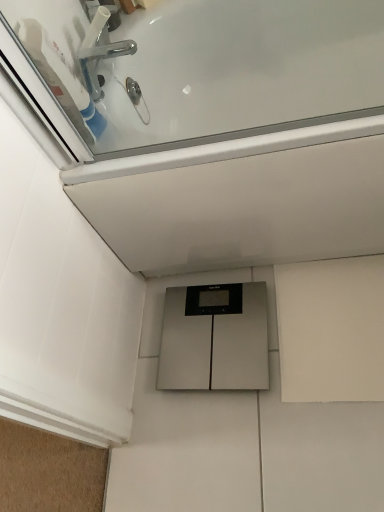
Describe the element at coordinates (215, 338) in the screenshot. The image size is (384, 512). I see `silver metallic scale at center` at that location.

What are the coordinates of `chrome metallic faucet at upper left` in the screenshot? It's located at (x=99, y=47).

From a real-world perspective, is chrome metallic faucet at upper left physically below silver metallic scale at center?

No, from a real-world perspective, chrome metallic faucet at upper left is not beneath silver metallic scale at center.

Between chrome metallic faucet at upper left and silver metallic scale at center, which one has smaller size?

chrome metallic faucet at upper left is smaller.

Which object is more forward, chrome metallic faucet at upper left or silver metallic scale at center?

Positioned in front is chrome metallic faucet at upper left.

Is white glossy bathtub at upper center situated inside silver metallic scale at center or outside?

white glossy bathtub at upper center cannot be found inside silver metallic scale at center.

Which is in front, white glossy bathtub at upper center or silver metallic scale at center?

white glossy bathtub at upper center is more forward.

Can you see white glossy bathtub at upper center touching silver metallic scale at center?

No, white glossy bathtub at upper center is not with silver metallic scale at center.

From the image's perspective, relative to white glossy bathtub at upper center, is silver metallic scale at center above or below?

silver metallic scale at center is situated lower than white glossy bathtub at upper center in the image.

Is white glossy bathtub at upper center surrounded by silver metallic scale at center?

No, white glossy bathtub at upper center is not a part of silver metallic scale at center.

Considering the relative positions of silver metallic scale at center and white glossy bathtub at upper center in the image provided, is silver metallic scale at center to the right of white glossy bathtub at upper center from the viewer's perspective?

Incorrect, silver metallic scale at center is not on the right side of white glossy bathtub at upper center.

This screenshot has height=512, width=384. I want to click on bath that appears in front of the silver metallic scale at center, so click(239, 70).

Can you tell me how much chrome metallic faucet at upper left and white glossy bathtub at upper center differ in facing direction?

88.4 degrees separate the facing orientations of chrome metallic faucet at upper left and white glossy bathtub at upper center.

You are a GUI agent. You are given a task and a screenshot of the screen. Output one action in this format:
    pyautogui.click(x=<x>, y=<y>)
    Task: Click on the tap on the left of white glossy bathtub at upper center
    Image resolution: width=384 pixels, height=512 pixels.
    Given the screenshot: What is the action you would take?
    pyautogui.click(x=99, y=47)

Based on the photo, is chrome metallic faucet at upper left oriented away from white glossy bathtub at upper center?

chrome metallic faucet at upper left is not turned away from white glossy bathtub at upper center.

Is silver metallic scale at center in front of or behind chrome metallic faucet at upper left in the image?

In the image, silver metallic scale at center appears behind chrome metallic faucet at upper left.

Looking at their sizes, would you say silver metallic scale at center is wider or thinner than chrome metallic faucet at upper left?

silver metallic scale at center is wider than chrome metallic faucet at upper left.

Which of these two, silver metallic scale at center or chrome metallic faucet at upper left, is smaller?

With smaller size is chrome metallic faucet at upper left.

From the image's perspective, relative to chrome metallic faucet at upper left, is silver metallic scale at center above or below?

From the image's perspective, silver metallic scale at center appears below chrome metallic faucet at upper left.

From the image's perspective, between white glossy bathtub at upper center and chrome metallic faucet at upper left, which one is located above?

chrome metallic faucet at upper left.

Which is in front, white glossy bathtub at upper center or chrome metallic faucet at upper left?

white glossy bathtub at upper center is closer to the camera.

This screenshot has height=512, width=384. What are the coordinates of `cabinetry below the chrome metallic faucet at upper left (from the image's perspective)` in the screenshot? It's located at pos(215,338).

Locate an element on the screen. This screenshot has height=512, width=384. bath in front of the silver metallic scale at center is located at coordinates (239, 70).

Based on the photo, from the image, which object appears to be farther from chrome metallic faucet at upper left, white glossy bathtub at upper center or silver metallic scale at center?

silver metallic scale at center is positioned further to the anchor chrome metallic faucet at upper left.

Which object lies further to the anchor point white glossy bathtub at upper center, silver metallic scale at center or chrome metallic faucet at upper left?

silver metallic scale at center is positioned further to the anchor white glossy bathtub at upper center.

Considering their positions, is chrome metallic faucet at upper left positioned closer to silver metallic scale at center than white glossy bathtub at upper center?

white glossy bathtub at upper center is closer to silver metallic scale at center.

Consider the image. Estimate the real-world distances between objects in this image. Which object is further from white glossy bathtub at upper center, chrome metallic faucet at upper left or silver metallic scale at center?

silver metallic scale at center.

From the image, which object appears to be farther from chrome metallic faucet at upper left, silver metallic scale at center or white glossy bathtub at upper center?

silver metallic scale at center is positioned further to the anchor chrome metallic faucet at upper left.

Estimate the real-world distances between objects in this image. Which object is closer to silver metallic scale at center, white glossy bathtub at upper center or chrome metallic faucet at upper left?

white glossy bathtub at upper center lies closer to silver metallic scale at center than the other object.

Identify the location of bath between chrome metallic faucet at upper left and silver metallic scale at center in the up-down direction. The width and height of the screenshot is (384, 512). (239, 70).